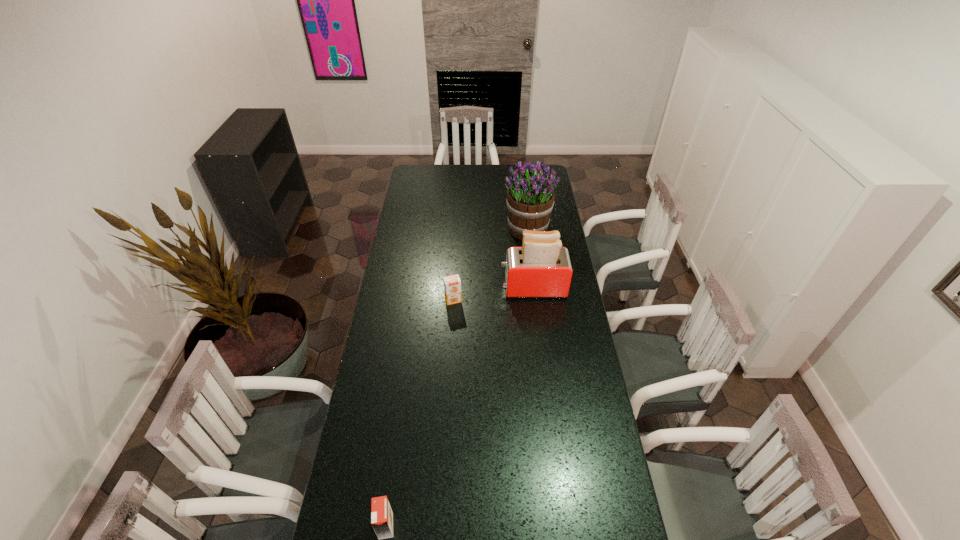
Locate which object is the third closest to the third object from right to left. Please provide its 2D coordinates. Your answer should be formatted as a tuple, i.e. [(x, y)], where the tuple contains the x and y coordinates of a point satisfying the conditions above.

[(381, 513)]

Find the location of `free location that satisfies the following two spatial constraints: 1. on the front-facing side of the second tallest object; 2. on the front side of the left orange juice`. free location that satisfies the following two spatial constraints: 1. on the front-facing side of the second tallest object; 2. on the front side of the left orange juice is located at coordinates (x=562, y=526).

Where is `vacant position in the image that satisfies the following two spatial constraints: 1. on the front-facing side of the second tallest object; 2. on the front side of the nearer orange juice`? The image size is (960, 540). vacant position in the image that satisfies the following two spatial constraints: 1. on the front-facing side of the second tallest object; 2. on the front side of the nearer orange juice is located at coordinates (562, 526).

The image size is (960, 540). I want to click on free space that satisfies the following two spatial constraints: 1. on the front-facing side of the second tallest object; 2. on the front side of the farther orange juice, so click(x=535, y=300).